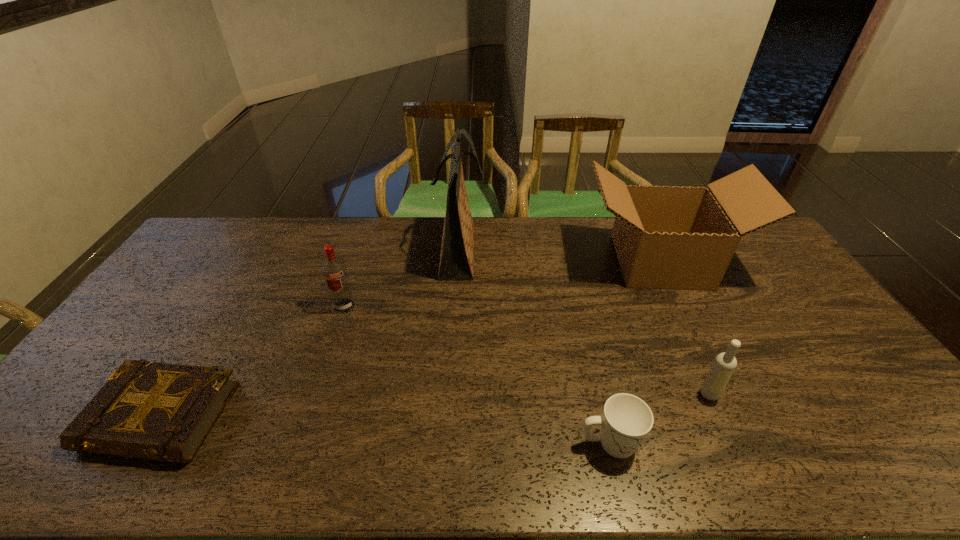
This screenshot has height=540, width=960. Find the location of `object that is at the left edge`. object that is at the left edge is located at coordinates (155, 411).

Locate an element on the screen. The width and height of the screenshot is (960, 540). object positioned at the right edge is located at coordinates (666, 237).

I want to click on object located in the near left corner section of the desktop, so click(x=155, y=411).

At what (x,y) coordinates should I click in order to perform the action: click on object positioned at the far right corner. Please return your answer as a coordinate pair (x, y). Image resolution: width=960 pixels, height=540 pixels. Looking at the image, I should click on (666, 237).

Find the location of `free space at the far edge`. free space at the far edge is located at coordinates (386, 232).

This screenshot has height=540, width=960. Identify the location of blank space at the near edge of the desktop. (778, 470).

The height and width of the screenshot is (540, 960). In the image, there is a desktop. In order to click on vacant space at the left edge in this screenshot , I will do `click(168, 281)`.

This screenshot has width=960, height=540. In order to click on free spot at the right edge of the desktop in this screenshot , I will do `click(799, 349)`.

In the image, there is a desktop. Identify the location of vacant area at the near left corner. Image resolution: width=960 pixels, height=540 pixels. (35, 475).

Find the location of a particular element. This screenshot has height=540, width=960. vacant point located between the fifth shortest object and the fifth object from right to left is located at coordinates (502, 284).